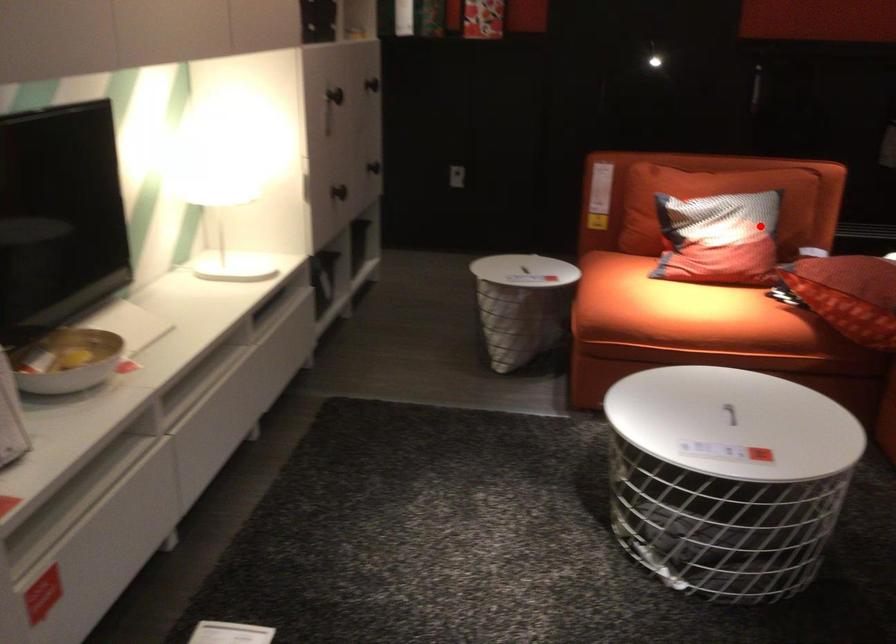
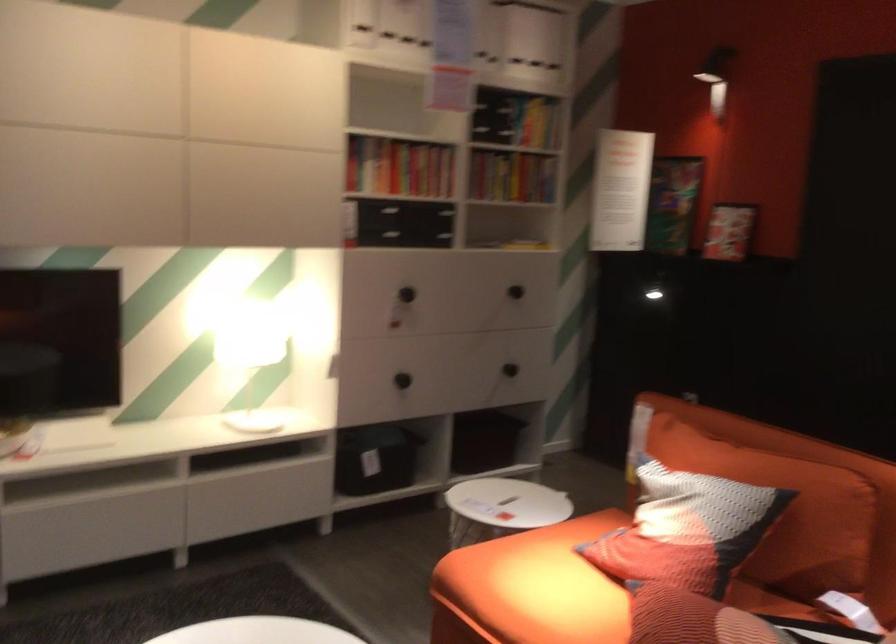
Question: A red point is marked in image1. In image2, is the corresponding 3D point closer to the camera or farther? Reply with the corresponding letter.

Choices:
 (A) The corresponding 3D point is closer.
 (B) The corresponding 3D point is farther.

Answer: (A)